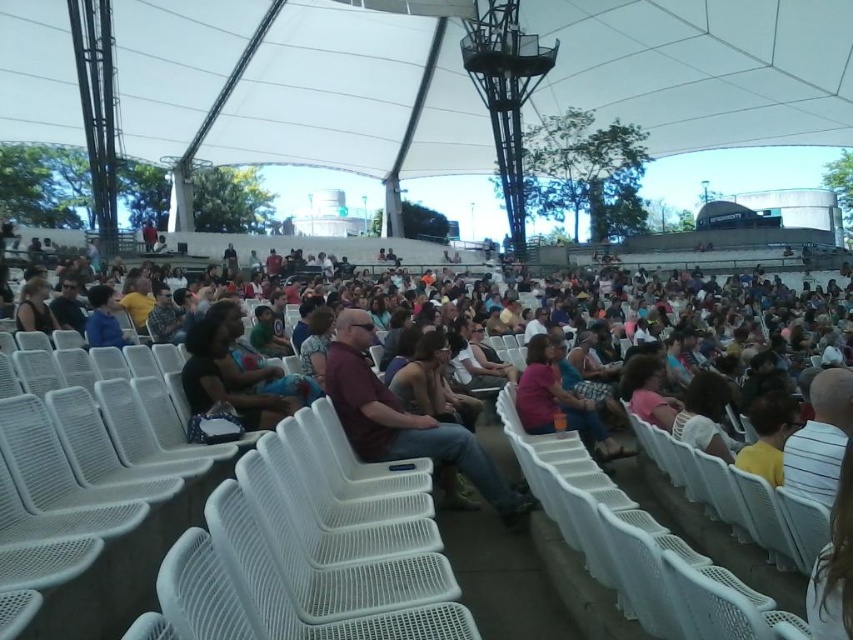
Question: Is matte blue shirt at center to the right of matte black shirt at center from the viewer's perspective?

Choices:
 (A) yes
 (B) no

Answer: (A)

Question: Which is farther from the matte black shirt at center?

Choices:
 (A) camouflage shirt at center
 (B) matte blue shirt at center

Answer: (A)

Question: Which point is farther from the camera taking this photo?

Choices:
 (A) 18,320
 (B) 386,456
 (C) 772,417
 (D) 608,449

Answer: (A)

Question: Can you confirm if maroon fabric shirt at center is thinner than dark blue fabric shirt at center?

Choices:
 (A) yes
 (B) no

Answer: (B)

Question: Which point is farther from the camera taking this photo?

Choices:
 (A) (161, 339)
 (B) (788, 400)

Answer: (A)

Question: Where is maroon fabric shirt at center located in relation to matte black shirt at left in the image?

Choices:
 (A) below
 (B) above

Answer: (A)